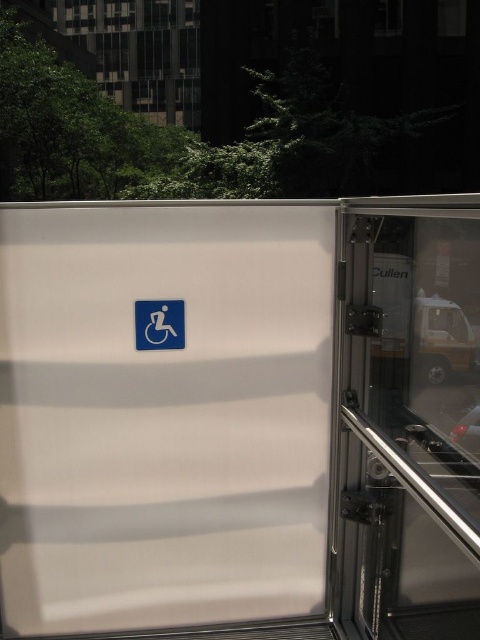
You are a delivery person standing 1 meter away from the transparent glass screen door at right. You need to place a package on the floor just inside the door. Can you reach the floor inside the door without moving closer?

The transparent glass screen door at right is 1.11 meters away from the camera. Since you are standing 1 meter away, you can reach the floor inside the door without moving closer because the distance is within your reach.

You are a bus driver who needs to check the size of the white matte screen door at center and the blue plastic sign at center to ensure they meet safety regulations. According to the description, which object is larger?

The white matte screen door at center is bigger than the blue plastic sign at center, so the door is larger.